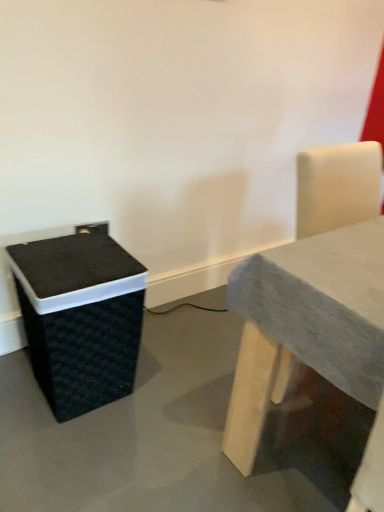
This screenshot has width=384, height=512. What are the coordinates of `free space above black woven basket at lower left (from a real-world perspective)` in the screenshot? It's located at (74, 258).